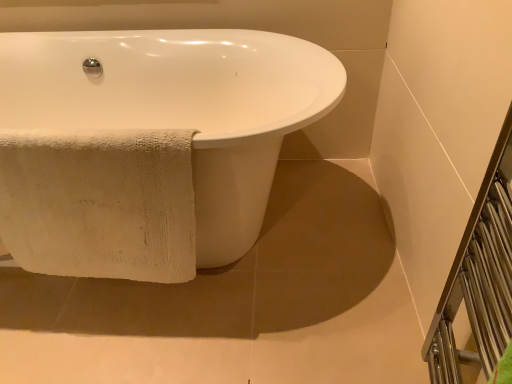
Question: In terms of size, does beige cotton towel at lower left appear bigger or smaller than white towel at lower left?

Choices:
 (A) small
 (B) big

Answer: (A)

Question: From a real-world perspective, is beige cotton towel at lower left positioned above or below white towel at lower left?

Choices:
 (A) above
 (B) below

Answer: (A)

Question: Which object is the closest to the white glossy bathtub at center?

Choices:
 (A) metallic silver balustrade at right
 (B) beige cotton towel at lower left
 (C) white towel at lower left

Answer: (B)

Question: Which object is the closest to the white glossy bathtub at center?

Choices:
 (A) beige cotton towel at lower left
 (B) white towel at lower left
 (C) metallic silver balustrade at right

Answer: (A)